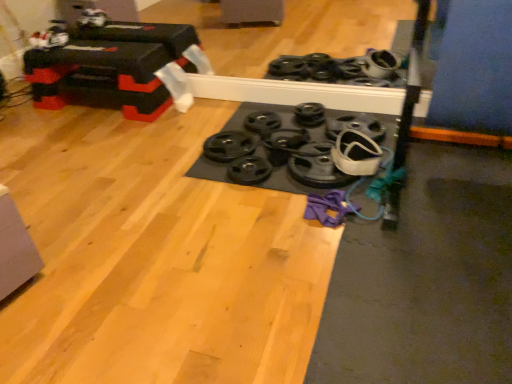
Question: Is black rubber weight plate at center, the fifth wheel in the left-to-right sequence, outside black rubber weights at center, marked as the first wheel in a left-to-right arrangement?

Choices:
 (A) no
 (B) yes

Answer: (B)

Question: Is black rubber weight plate at center, the fifth wheel in the left-to-right sequence, shorter than black rubber weights at center, marked as the first wheel in a left-to-right arrangement?

Choices:
 (A) yes
 (B) no

Answer: (B)

Question: Does black rubber weight plate at center, acting as the 2th wheel starting from the right, contain black rubber weights at center, the sixth wheel positioned from the right?

Choices:
 (A) yes
 (B) no

Answer: (B)

Question: Is black rubber weight plate at center, acting as the 2th wheel starting from the right, smaller than black rubber weights at center, marked as the first wheel in a left-to-right arrangement?

Choices:
 (A) no
 (B) yes

Answer: (A)

Question: From a real-world perspective, is black rubber weight plate at center, the fifth wheel in the left-to-right sequence, positioned under black rubber weights at center, marked as the first wheel in a left-to-right arrangement, based on gravity?

Choices:
 (A) no
 (B) yes

Answer: (A)

Question: Is black rubber weight plate at center, acting as the 2th wheel starting from the right, facing towards black rubber weights at center, the sixth wheel positioned from the right?

Choices:
 (A) no
 (B) yes

Answer: (A)

Question: Are black rubber weight plate at center, the 4th wheel viewed from the right, and black rubber weight plate at center, placed as the 1th wheel when sorted from right to left, far apart?

Choices:
 (A) no
 (B) yes

Answer: (A)

Question: Is black rubber weight plate at center, placed as the 1th wheel when sorted from right to left, a part of black rubber weight plate at center, the 4th wheel viewed from the right?

Choices:
 (A) no
 (B) yes

Answer: (A)

Question: Is black rubber weight plate at center, the 4th wheel viewed from the right, positioned with its back to black rubber weight plate at center, placed as the 1th wheel when sorted from right to left?

Choices:
 (A) yes
 (B) no

Answer: (B)

Question: From the image's perspective, would you say black rubber weight plate at center, the 3th wheel viewed from the left, is shown under black rubber weight plate at center, placed as the 1th wheel when sorted from right to left?

Choices:
 (A) no
 (B) yes

Answer: (B)

Question: Does black rubber weight plate at center, the 3th wheel viewed from the left, appear on the right side of black rubber weight plate at center, placed as the 1th wheel when sorted from right to left?

Choices:
 (A) yes
 (B) no

Answer: (B)

Question: Does black rubber weight plate at center, the 3th wheel viewed from the left, lie in front of black rubber weight plate at center, placed as the 1th wheel when sorted from right to left?

Choices:
 (A) yes
 (B) no

Answer: (B)

Question: Does black rubber weights at center, marked as the first wheel in a left-to-right arrangement, have a lesser height compared to black rubber weight plate at center, the fourth wheel positioned from the left?

Choices:
 (A) yes
 (B) no

Answer: (A)